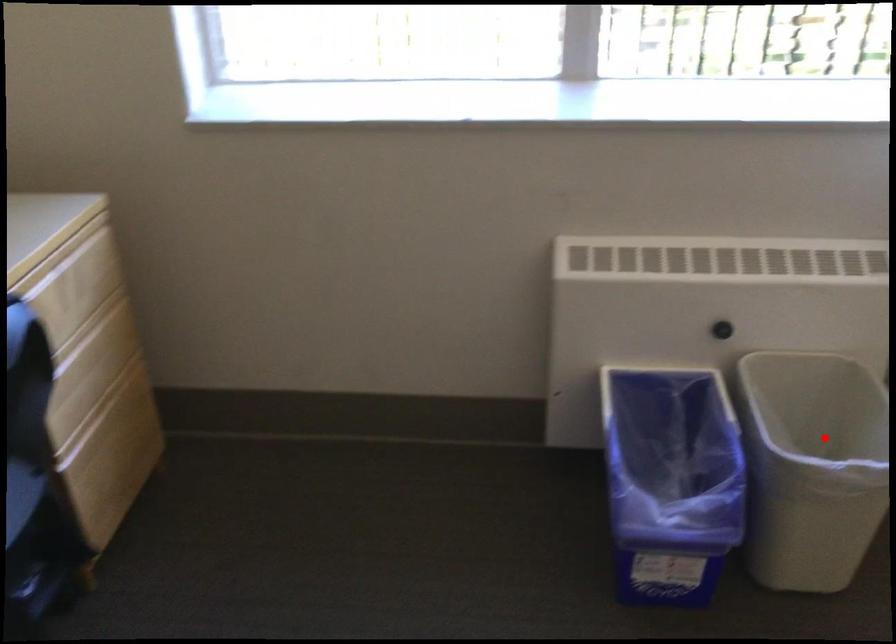
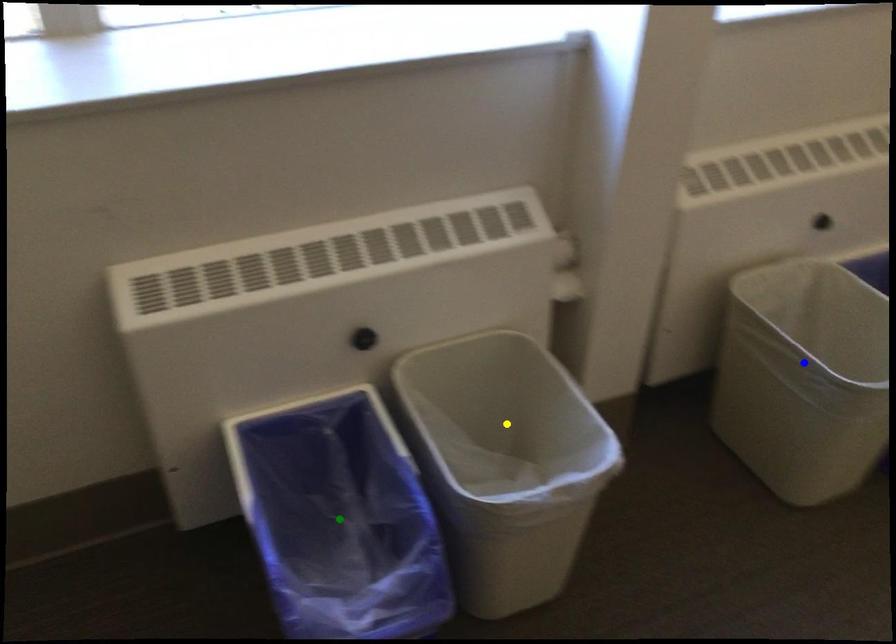
Question: I am providing you with two images of the same scene from different viewpoints. A red point is marked on the first image. You are given multiple points on the second image. Can you choose the point in image 2 that corresponds to the point in image 1?

Choices:
 (A) blue point
 (B) green point
 (C) yellow point

Answer: (C)